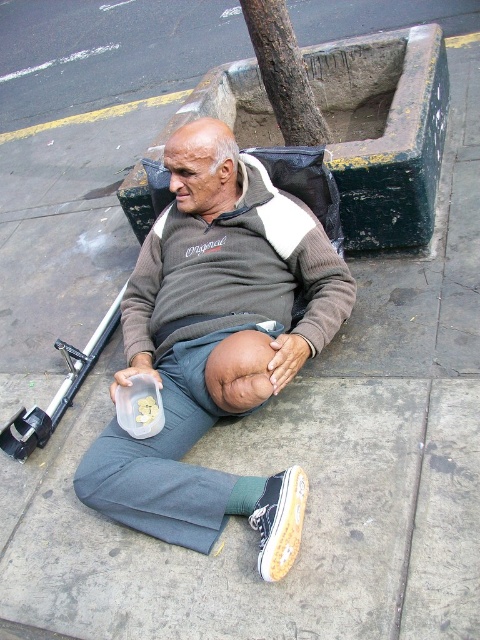
Consider the image. Does gray cotton sweater at center come behind white canvas shoe at lower center?

Yes, it is behind white canvas shoe at lower center.

Who is more distant from viewer, [257,522] or [283,532]?

Positioned behind is point [257,522].

This screenshot has height=640, width=480. I want to click on gray cotton sweater at center, so click(x=216, y=346).